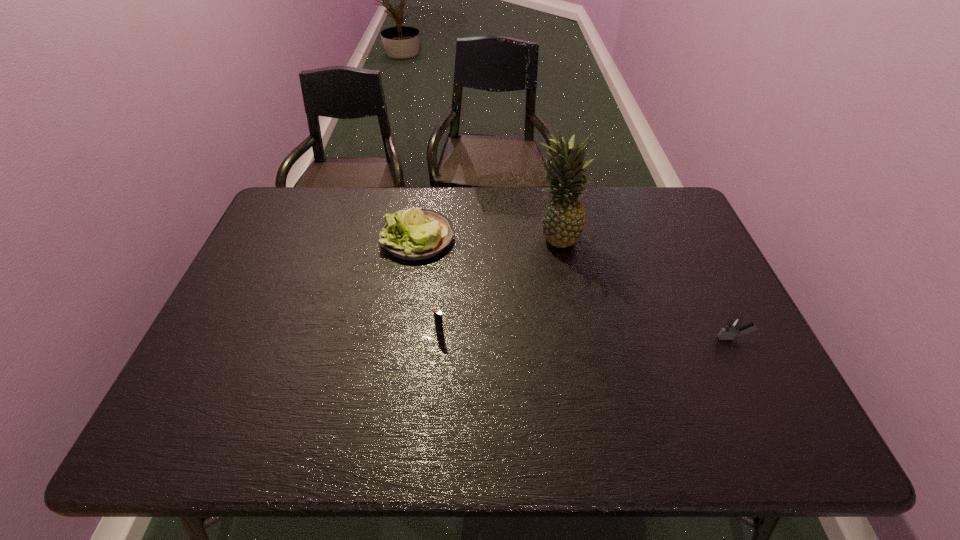
What are the coordinates of `vacant area that lies between the right igniter and the lettuce` in the screenshot? It's located at (575, 288).

This screenshot has width=960, height=540. What are the coordinates of `vacant space in between the lettuce and the left igniter` in the screenshot? It's located at (428, 284).

This screenshot has height=540, width=960. In order to click on vacant space in between the lettuce and the third object from left to right in this screenshot , I will do `click(487, 237)`.

Locate an element on the screen. free spot between the lettuce and the rightmost object is located at coordinates (575, 288).

Identify the location of vacant point located between the pineapple and the left igniter. The height and width of the screenshot is (540, 960). (497, 284).

At what (x,y) coordinates should I click in order to perform the action: click on vacant space that is in between the second object from right to left and the left igniter. Please return your answer as a coordinate pair (x, y). Image resolution: width=960 pixels, height=540 pixels. Looking at the image, I should click on (497, 284).

Where is `object that is the third closest one to the left igniter`? The width and height of the screenshot is (960, 540). object that is the third closest one to the left igniter is located at coordinates (734, 325).

You are a GUI agent. You are given a task and a screenshot of the screen. Output one action in this format:
    pyautogui.click(x=<x>, y=<y>)
    Task: Click on the object that is the second closest one to the lettuce
    This screenshot has height=540, width=960.
    Given the screenshot: What is the action you would take?
    pyautogui.click(x=437, y=313)

Find the location of a particular element. The height and width of the screenshot is (540, 960). blank area in the image that satisfies the following two spatial constraints: 1. on the front side of the rightmost object; 2. on the left side of the lettuce is located at coordinates (402, 338).

Where is `blank space that satisfies the following two spatial constraints: 1. on the back side of the left igniter; 2. on the left side of the second object from right to left`? blank space that satisfies the following two spatial constraints: 1. on the back side of the left igniter; 2. on the left side of the second object from right to left is located at coordinates (447, 236).